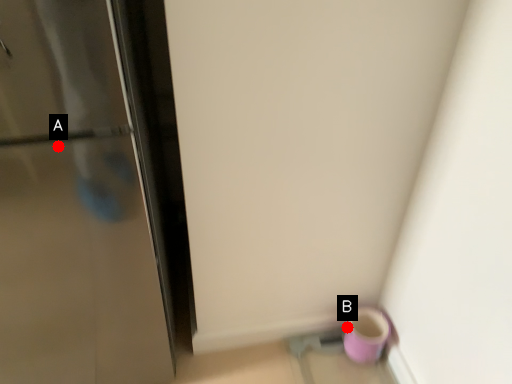
Question: Two points are circled on the image, labeled by A and B beside each circle. Which of the following is the closest to the observer?

Choices:
 (A) A is closer
 (B) B is closer

Answer: (A)